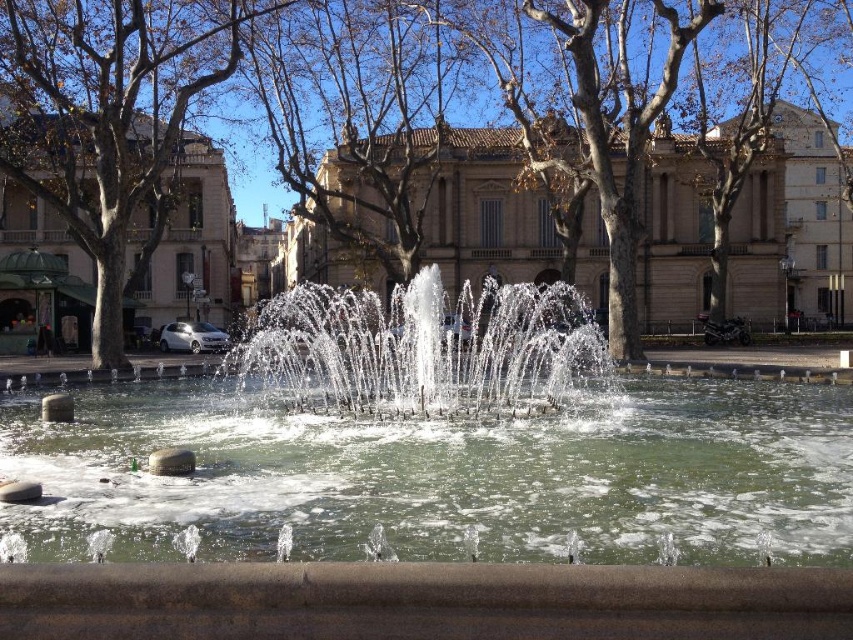
Question: Which point is farther to the camera?

Choices:
 (A) clear water at center
 (B) brown leafless tree at left
 (C) brown leafless tree at center
 (D) clear water fountain at center

Answer: (C)

Question: Which object is positioned farthest from the clear water fountain at center?

Choices:
 (A) clear water at center
 (B) brown leafless tree at center
 (C) brown leafless tree at left

Answer: (C)

Question: Is clear water at center to the left of brown leafless tree at center from the viewer's perspective?

Choices:
 (A) yes
 (B) no

Answer: (A)

Question: Does brown leafless tree at center appear on the left side of clear water fountain at center?

Choices:
 (A) no
 (B) yes

Answer: (A)

Question: Which of these objects is positioned farthest from the clear water at center?

Choices:
 (A) brown leafless tree at left
 (B) clear water fountain at center
 (C) brown leafless tree at center

Answer: (C)

Question: Can you confirm if clear water at center is positioned to the right of clear water fountain at center?

Choices:
 (A) no
 (B) yes

Answer: (B)